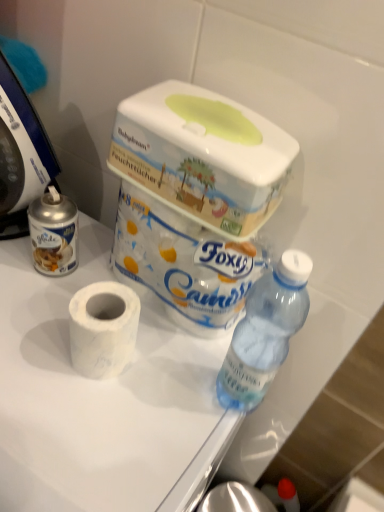
The width and height of the screenshot is (384, 512). Identify the location of vacant space to the right of white matte toilet paper at center, which is the 1th toilet paper from bottom to top. [x=184, y=373].